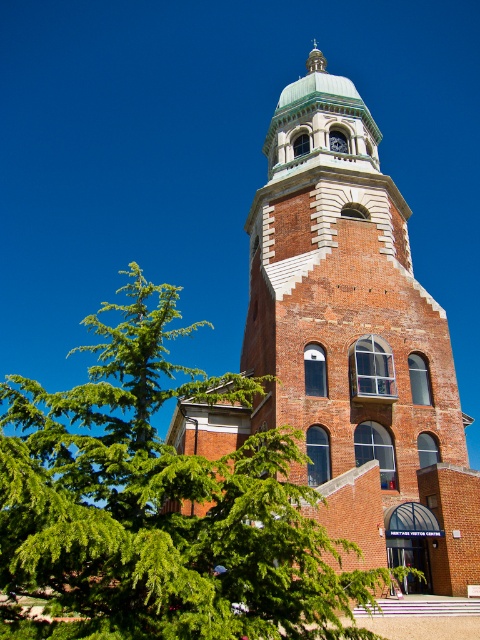
Find the location of a particular element. green leafy tree at lower left is located at coordinates (158, 506).

Looking at this image, is green leafy tree at lower left closer to the viewer compared to brick tower at center?

Yes, green leafy tree at lower left is closer to the viewer.

Where is `green leafy tree at lower left`? Image resolution: width=480 pixels, height=640 pixels. green leafy tree at lower left is located at coordinates (158, 506).